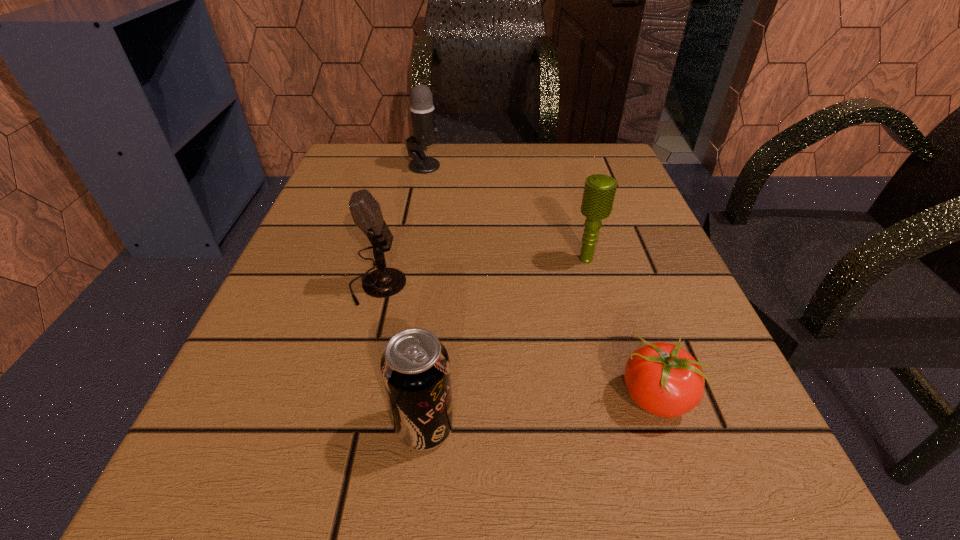
The image size is (960, 540). Find the location of `the farthest microphone`. the farthest microphone is located at coordinates (422, 110).

This screenshot has height=540, width=960. I want to click on the third farthest object, so click(x=384, y=282).

Where is `the second nearest microphone`? The width and height of the screenshot is (960, 540). the second nearest microphone is located at coordinates (599, 192).

The width and height of the screenshot is (960, 540). Find the location of `the fourth nearest object`. the fourth nearest object is located at coordinates (599, 192).

Locate an element on the screen. This screenshot has width=960, height=540. soda can is located at coordinates (415, 368).

Where is `the shortest object`? The width and height of the screenshot is (960, 540). the shortest object is located at coordinates (663, 379).

At what (x,y) coordinates should I click in order to perform the action: click on free space located on the front of the farthest object. Please return your answer as a coordinate pair (x, y). Image resolution: width=960 pixels, height=540 pixels. Looking at the image, I should click on (400, 287).

What are the coordinates of `free region located 0.340m on the front-facing side of the third nearest object` in the screenshot? It's located at (626, 286).

This screenshot has width=960, height=540. What are the coordinates of `free spot located on the back of the fourth nearest object` in the screenshot? It's located at (569, 197).

Locate an element on the screen. The width and height of the screenshot is (960, 540). blank space located 0.090m on the left of the soda can is located at coordinates 317,427.